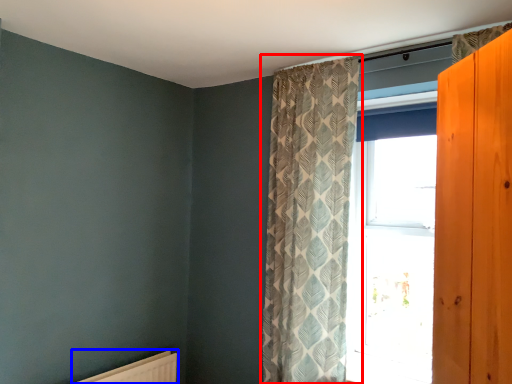
Question: Among these objects, which one is farthest to the camera, curtain (highlighted by a red box) or radiator (highlighted by a blue box)?

Choices:
 (A) curtain
 (B) radiator

Answer: (B)